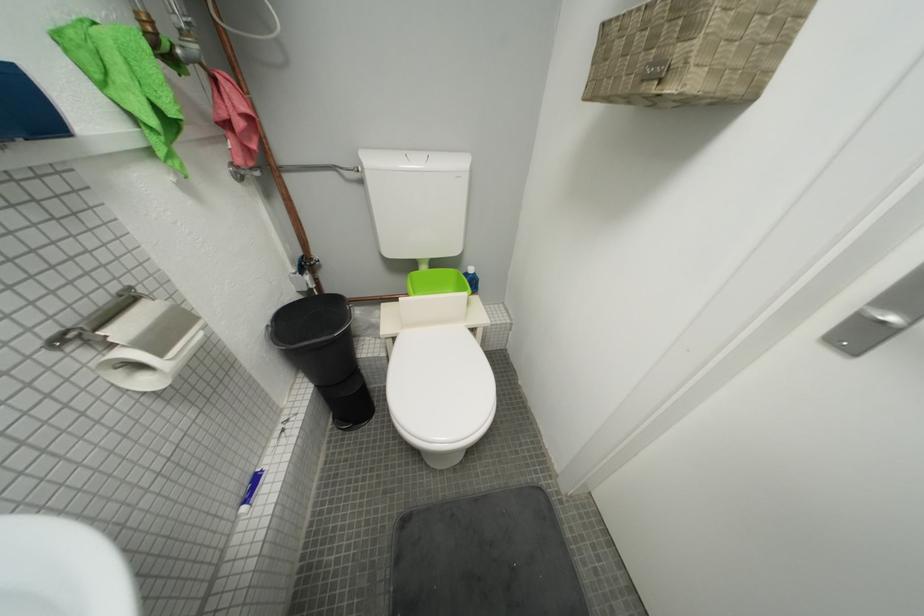
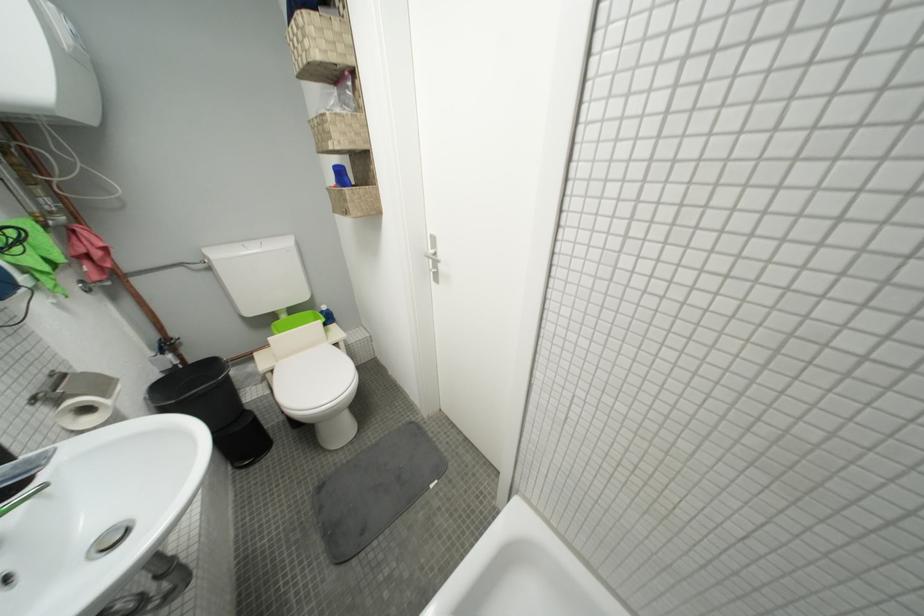
Where in the second image is the point corresponding to (x=315, y=265) from the first image?

(175, 347)